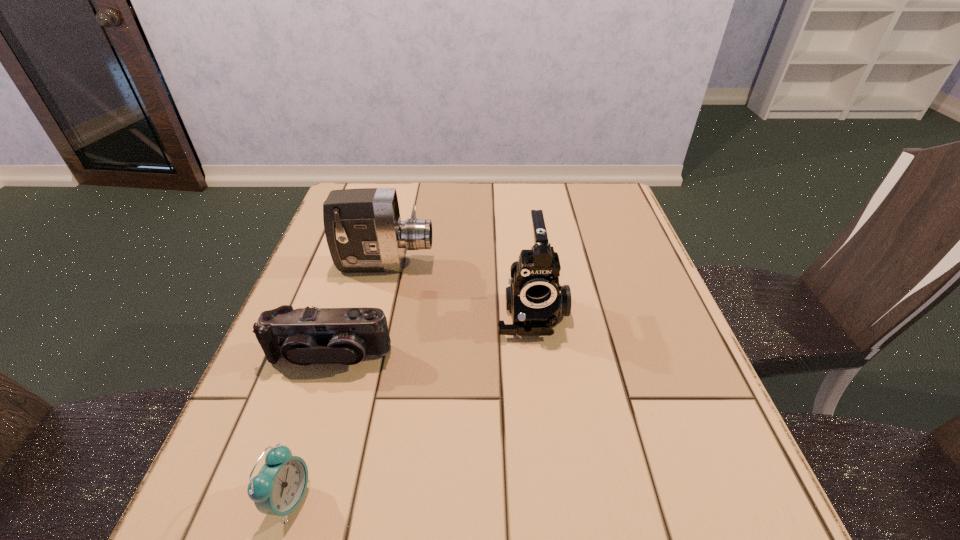
Locate an element on the screen. This screenshot has width=960, height=540. object that is positioned at the near left corner is located at coordinates (278, 489).

In the image, there is a desktop. In order to click on vacant space at the far edge in this screenshot , I will do `click(482, 221)`.

Locate an element on the screen. The image size is (960, 540). vacant position at the near edge of the desktop is located at coordinates (363, 526).

Find the location of a particular element. Image resolution: width=960 pixels, height=540 pixels. vacant region at the left edge of the desktop is located at coordinates (314, 469).

Identify the location of vacant space at the right edge of the desktop. (644, 293).

Identify the location of vacant region at the near left corner. This screenshot has width=960, height=540. [x=216, y=491].

Find the location of a particular element. vacant space at the far right corner is located at coordinates coord(587,194).

In order to click on empty space between the nearest object and the shortest camcorder in this screenshot , I will do `click(309, 427)`.

Find the location of a particular element. This screenshot has width=960, height=540. free space between the rightmost camcorder and the farthest camcorder is located at coordinates (458, 287).

This screenshot has height=540, width=960. I want to click on vacant area between the farthest camcorder and the rightmost camcorder, so click(x=458, y=287).